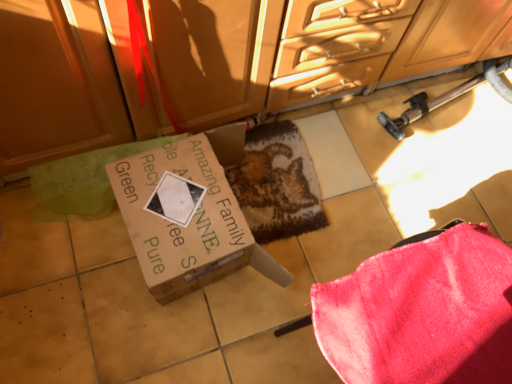
Locate an element on the screen. The image size is (512, 384). vacant space to the right of textured brown mat at center is located at coordinates (367, 187).